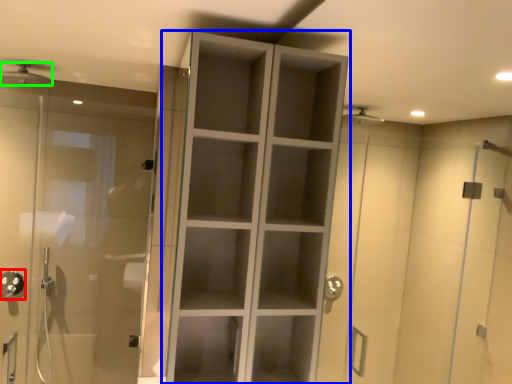
Question: Which is farther away from shower (highlighted by a red box)? cupboard (highlighted by a blue box) or shower (highlighted by a green box)?

Choices:
 (A) cupboard
 (B) shower

Answer: (A)